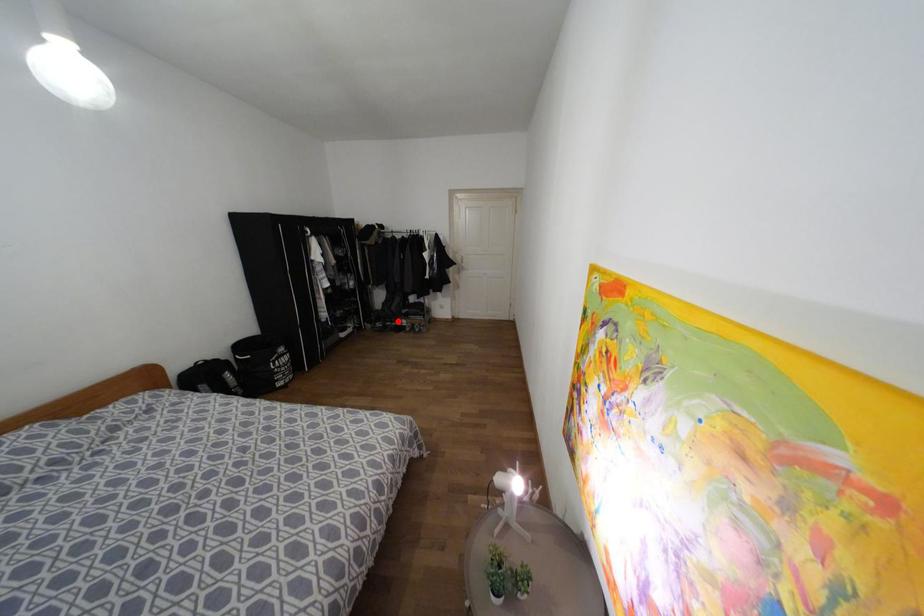
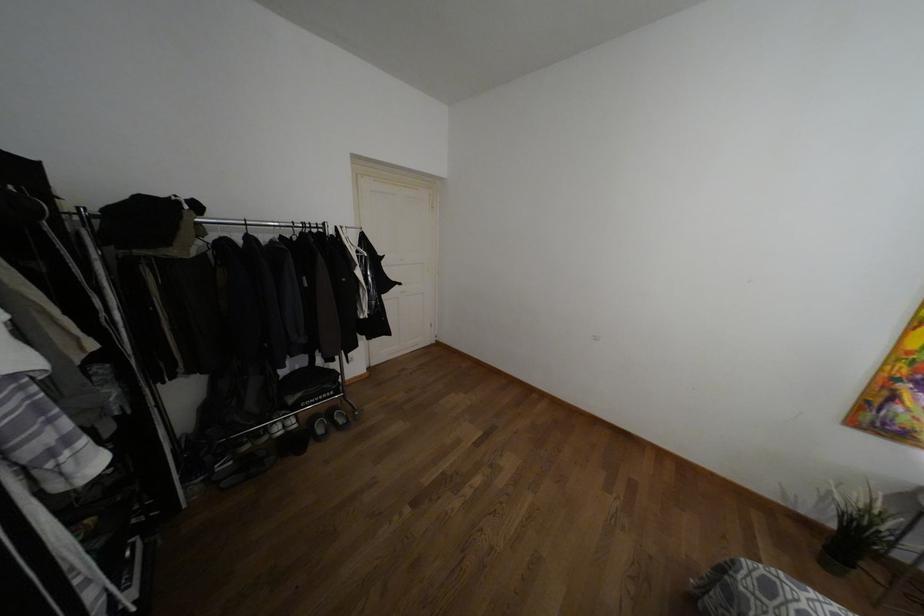
Locate, in the second image, the point that corresponds to the highlighted location in the first image.

(275, 427)